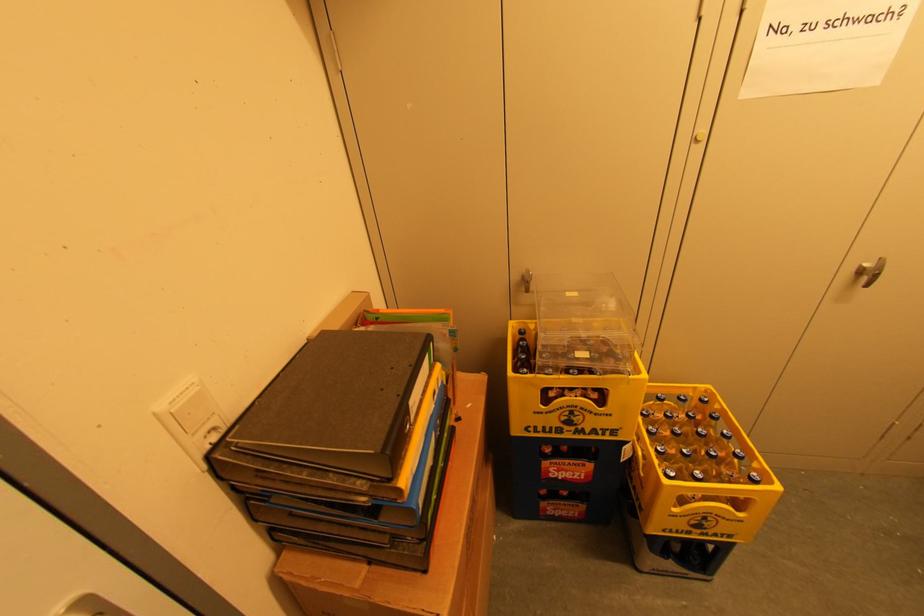
You are a GUI agent. You are given a task and a screenshot of the screen. Output one action in this format:
    pyautogui.click(x=<x>, y=<y>)
    Task: Click on the metal locker handle
    The image size is (924, 616).
    Given the screenshot: What is the action you would take?
    pyautogui.click(x=869, y=272)